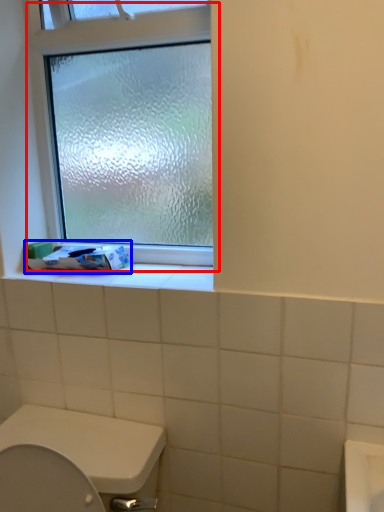
Question: Which object is further to the camera taking this photo, window (highlighted by a red box) or toilet paper (highlighted by a blue box)?

Choices:
 (A) window
 (B) toilet paper

Answer: (B)